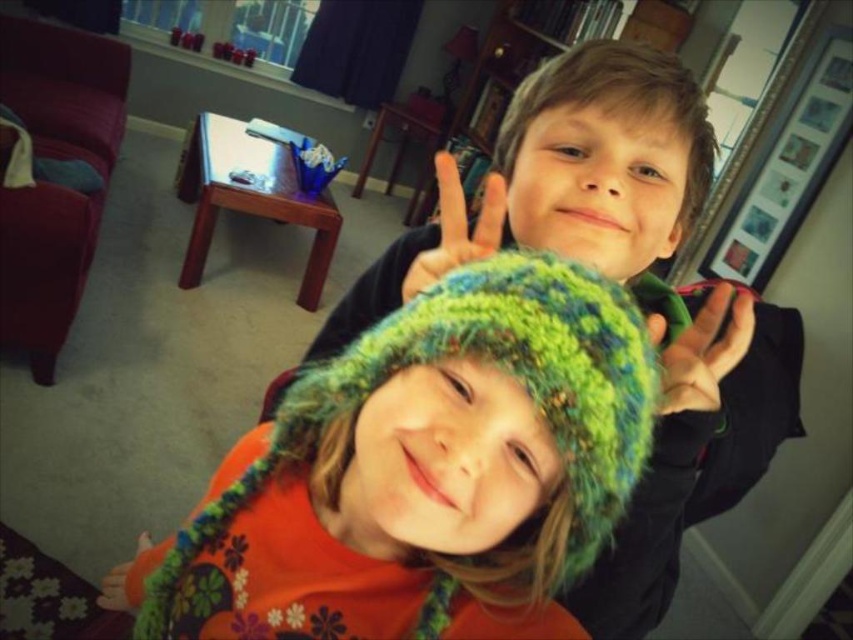
You are a photographer trying to capture both children in a photo. The knitted green hat at center and the matte green knitted hat at center are both in the frame. Which hat appears narrower in the photo?

The knitted green hat at center appears narrower in the photo compared to the matte green knitted hat at center as stated in the description.

You are a photographer trying to capture the knitted green hat at center and the green knitted glove at upper right in a single shot. Can you focus on both objects clearly at the same time?

The knitted green hat at center is in front of the green knitted glove at upper right, so focusing on both clearly at the same time may be challenging due to their different distances from the camera.

You are a photographer setting up for a family photo. You notice two children in the living room wearing knitted green hats. The first child has a hat with ear flaps, and the second has a matte finish hat. You want to position them so that the child with the matte green knitted hat at center is on the left side of the photo. Based on their current positions, should you move the child with the knitted green hat at center to the right or left?

The knitted green hat at center is currently to the left of the matte green knitted hat at center. To position the matte green knitted hat at center on the left, you should move the child with the knitted green hat at center to the right.